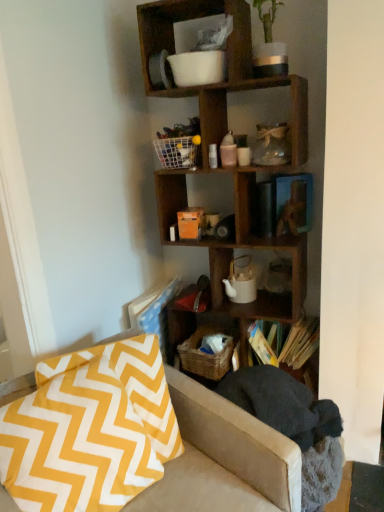
Question: Based on their sizes in the image, would you say wooden shelf at upper center is bigger or smaller than yellow and white zigzag fabric at lower left?

Choices:
 (A) small
 (B) big

Answer: (A)

Question: Which is correct: wooden shelf at upper center is inside yellow and white zigzag fabric at lower left, or outside of it?

Choices:
 (A) outside
 (B) inside

Answer: (A)

Question: Estimate the real-world distances between objects in this image. Which object is closer to the woven brown basket at lower center?

Choices:
 (A) hardcover books at center
 (B) yellow and white zigzag fabric at lower left
 (C) white mesh basket at upper center
 (D) yellow zigzag fabric pillow at lower left, which appears as the 1th pillow when viewed from the front
 (E) wooden shelf at upper center

Answer: (A)

Question: Considering the real-world distances, which object is closest to the yellow and white zigzag fabric at lower left?

Choices:
 (A) wooden shelf at upper center
 (B) hardcover books at center
 (C) yellow zigzag fabric pillow at lower left, the second pillow viewed from the front
 (D) white mesh basket at upper center
 (E) woven brown basket at lower center

Answer: (C)